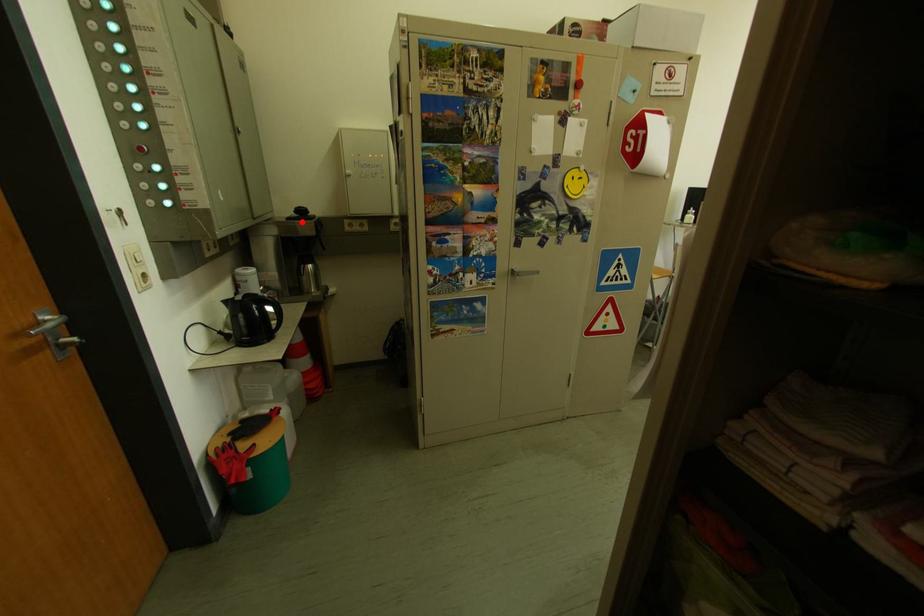
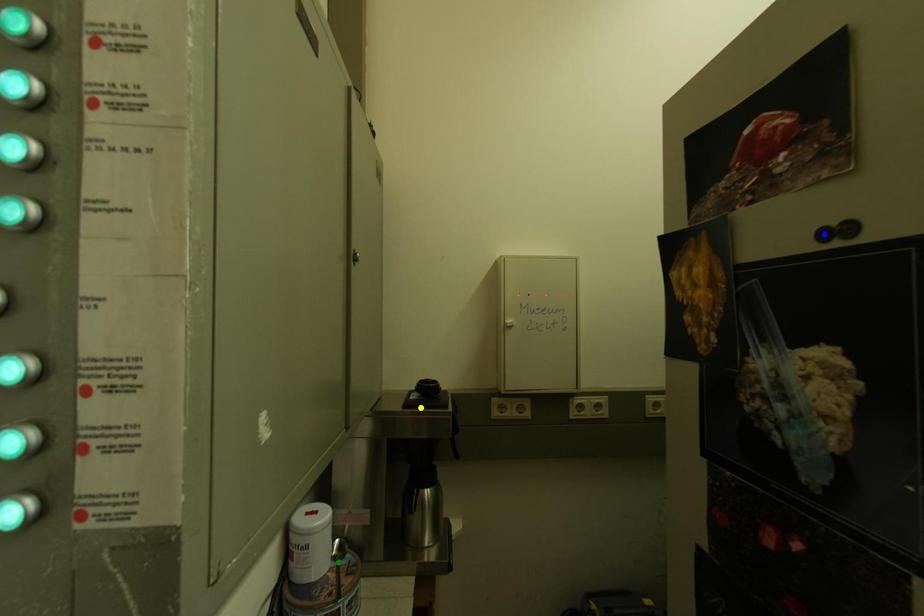
Question: I am providing you with two images of the same scene from different viewpoints. A red point is marked on the first image. You are given multiple points on the second image. Which spot in image 2 lines up with the point in image 1?

Choices:
 (A) yellow point
 (B) blue point
 (C) green point

Answer: (A)